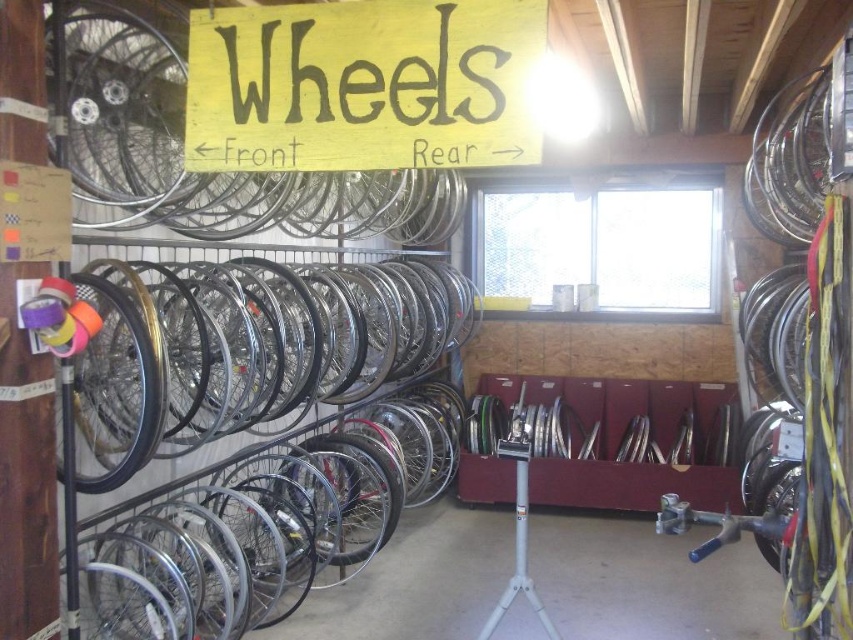
Question: Is silver metallic rim at upper left closer to camera compared to gold metallic rim at left?

Choices:
 (A) no
 (B) yes

Answer: (B)

Question: Does yellow wood sign at upper center appear on the left side of silver metallic rim at upper left?

Choices:
 (A) no
 (B) yes

Answer: (A)

Question: Which object appears farthest from the camera in this image?

Choices:
 (A) yellow wood sign at upper center
 (B) gold metallic rim at left
 (C) silver metallic rim at upper left

Answer: (B)

Question: Which point is farther from the camera taking this photo?

Choices:
 (A) (186, 157)
 (B) (91, 301)

Answer: (B)

Question: Which of these objects is positioned farthest from the gold metallic rim at left?

Choices:
 (A) silver metallic rim at upper left
 (B) yellow wood sign at upper center

Answer: (A)

Question: Is the position of yellow wood sign at upper center more distant than that of gold metallic rim at left?

Choices:
 (A) yes
 (B) no

Answer: (B)